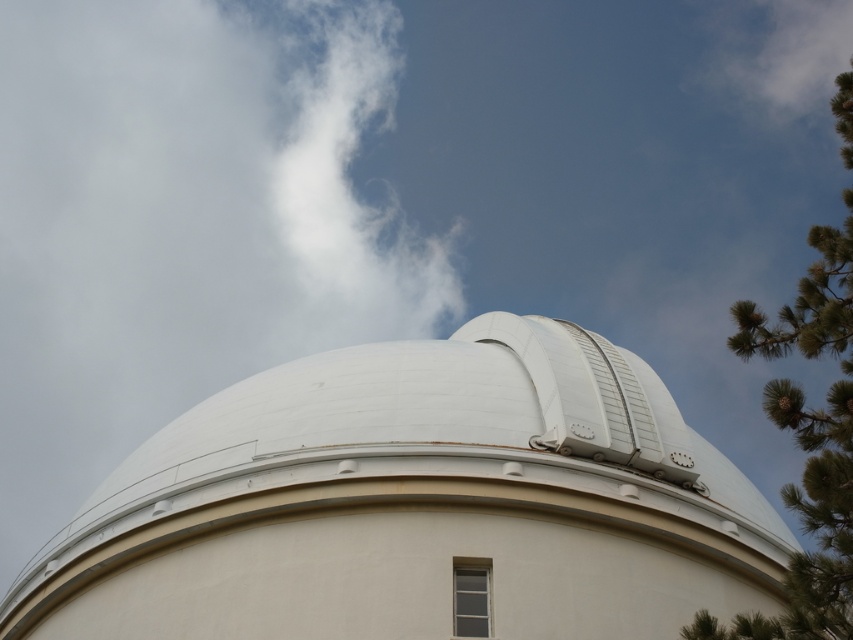
You are standing in front of the observatory dome and want to determine the relative positions of two points marked on the dome. The first point is at coordinates point (250, 476) and the second is at point (119, 65). Which point is closer to you?

Point (250, 476) is closer to the viewer than point (119, 65).

You are an astronomer standing outside the observatory and want to take a photo of the white smooth dome at center and the white fluffy cloud at upper left. Which object will appear bigger in the photo?

The white smooth dome at center will appear bigger in the photo because it is larger in size than the white fluffy cloud at upper left according to the description.

You are an astronomer standing outside the observatory and want to take a photo of the white smooth dome at center and the white fluffy cloud at upper left. Which object will appear larger in your photo?

The white smooth dome at center will appear larger in the photo because it is closer to the viewer than the white fluffy cloud at upper left.